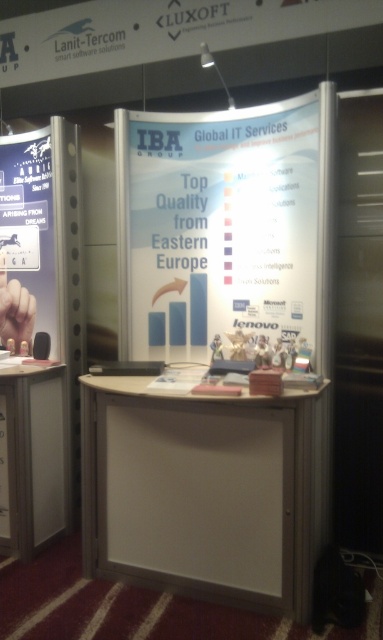
You are at the IBA Group exhibition booth and need to place a new promotional item. The item requires a surface wider than the white plastic information desk at lower left. Can the white paper at center provide enough space?

The white paper at center might be wider than white plastic information desk at lower left, so it could potentially provide enough space for the promotional item.

You are a visitor at the exhibition and want to know which desk is taller between the white matte desk at center and the white plastic information desk at lower left. Can you tell me which one is taller?

The white matte desk at center is taller than the white plastic information desk at lower left according to the description.